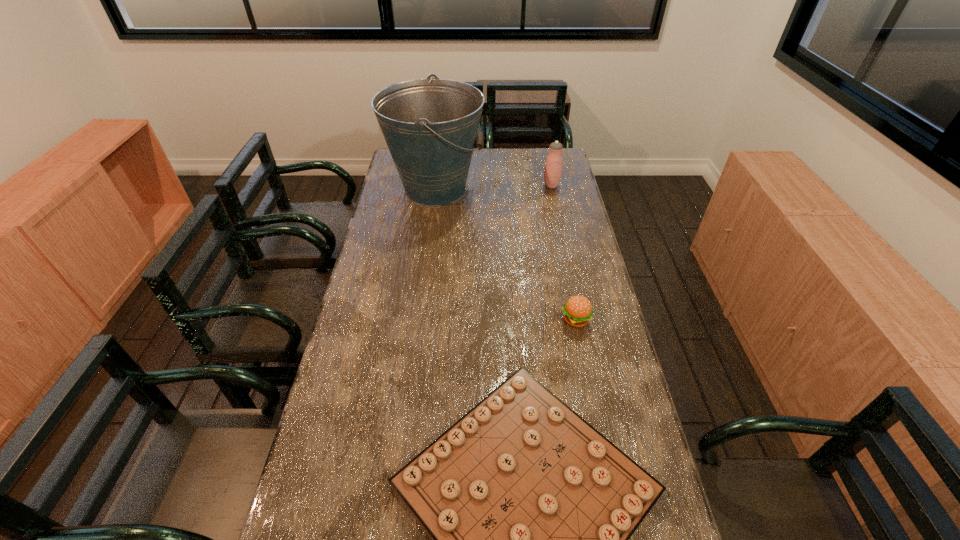
This screenshot has height=540, width=960. I want to click on the tallest object, so click(430, 126).

Where is `thermos bottle`? The image size is (960, 540). thermos bottle is located at coordinates (553, 168).

You are a GUI agent. You are given a task and a screenshot of the screen. Output one action in this format:
    pyautogui.click(x=<x>, y=<y>)
    Task: Click on the hamburger
    The image size is (960, 540).
    Given the screenshot: What is the action you would take?
    pyautogui.click(x=578, y=311)

This screenshot has height=540, width=960. What are the coordinates of `the third tallest object` in the screenshot? It's located at (578, 311).

You are a GUI agent. You are given a task and a screenshot of the screen. Output one action in this format:
    pyautogui.click(x=<x>, y=<y>)
    Task: Click on the vacant space located with the handle on opposite sides of the bucket
    
    Given the screenshot: What is the action you would take?
    pyautogui.click(x=525, y=189)

The image size is (960, 540). Find the location of `free spot located on the front of the second tallest object`. free spot located on the front of the second tallest object is located at coordinates (556, 208).

You are a GUI agent. You are given a task and a screenshot of the screen. Output one action in this format:
    pyautogui.click(x=<x>, y=<y>)
    Task: Click on the free region located on the back of the hamburger
    
    Given the screenshot: What is the action you would take?
    pyautogui.click(x=558, y=232)

Locate an element on the screen. The image size is (960, 540). object situated at the far edge is located at coordinates (430, 126).

Identify the location of object positioned at the left edge. (430, 126).

Where is `thermos bottle that is at the right edge`? The width and height of the screenshot is (960, 540). thermos bottle that is at the right edge is located at coordinates click(x=553, y=168).